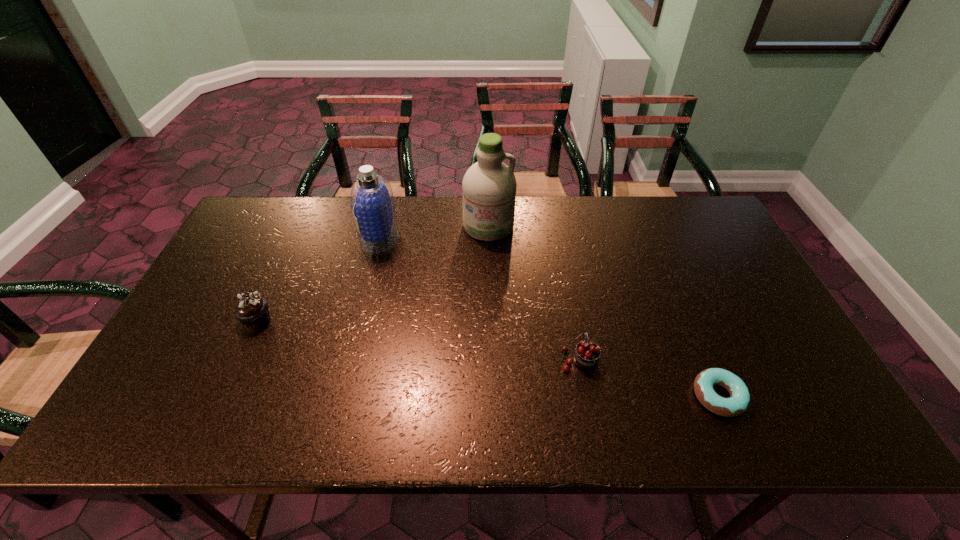
This screenshot has height=540, width=960. I want to click on vacant area that lies between the second object from right to left and the third nearest object, so click(x=418, y=339).

Locate an element on the screen. free space between the third nearest object and the right cleansing agent is located at coordinates (372, 273).

Image resolution: width=960 pixels, height=540 pixels. I want to click on unoccupied position between the fourth object from left to right and the third farthest object, so click(x=418, y=339).

The image size is (960, 540). What are the coordinates of `unoccupied area between the third farthest object and the second tallest object` in the screenshot? It's located at (319, 279).

Locate an element on the screen. The height and width of the screenshot is (540, 960). vacant space that is in between the third object from right to left and the rightmost object is located at coordinates (603, 311).

This screenshot has width=960, height=540. I want to click on vacant region between the tallest object and the second object from right to left, so click(534, 292).

Locate which object is the second closest to the left cleansing agent. Please provide its 2D coordinates. Your answer should be formatted as a tuple, i.e. [(x, y)], where the tuple contains the x and y coordinates of a point satisfying the conditions above.

[(251, 309)]

You are a GUI agent. You are given a task and a screenshot of the screen. Output one action in this format:
    pyautogui.click(x=<x>, y=<y>)
    Task: Click on the object identified as the closest to the rightmost object
    
    Given the screenshot: What is the action you would take?
    pyautogui.click(x=587, y=353)

You are a GUI agent. You are given a task and a screenshot of the screen. Output one action in this format:
    pyautogui.click(x=<x>, y=<y>)
    Task: Click on the free point that satisfies the following two spatial constraints: 1. on the front label of the rightmost object; 2. on the left side of the taller cleansing agent
    Image resolution: width=960 pixels, height=540 pixels.
    Given the screenshot: What is the action you would take?
    pyautogui.click(x=492, y=396)

I want to click on free location that satisfies the following two spatial constraints: 1. on the front label of the tallest object; 2. on the left side of the shortest object, so click(492, 396).